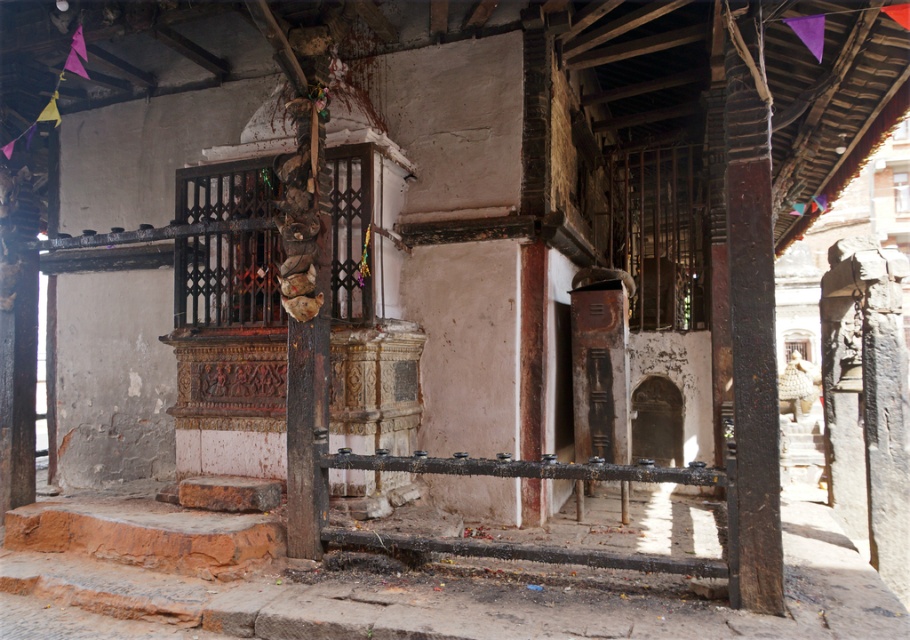
Question: Is brown rough wood pillar at right closer to the viewer compared to rusty metal rail at center?

Choices:
 (A) no
 (B) yes

Answer: (B)

Question: Does brown rough wood pillar at right lie behind rusty metal rail at center?

Choices:
 (A) no
 (B) yes

Answer: (A)

Question: Can you confirm if brown rough wood pillar at right is wider than rusty metal rail at center?

Choices:
 (A) no
 (B) yes

Answer: (A)

Question: Among these objects, which one is farthest from the camera?

Choices:
 (A) brown rough wood pillar at right
 (B) rusty metal rail at center

Answer: (B)